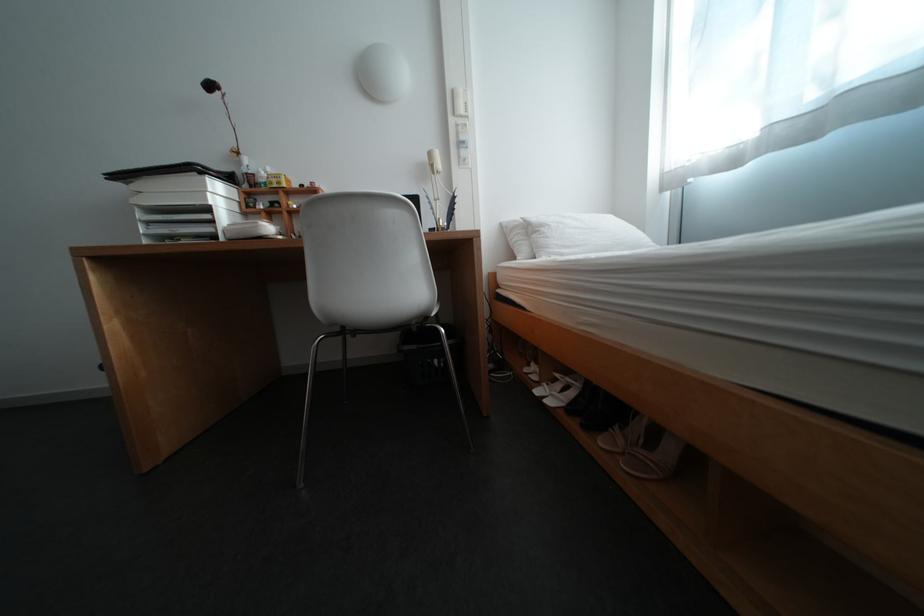
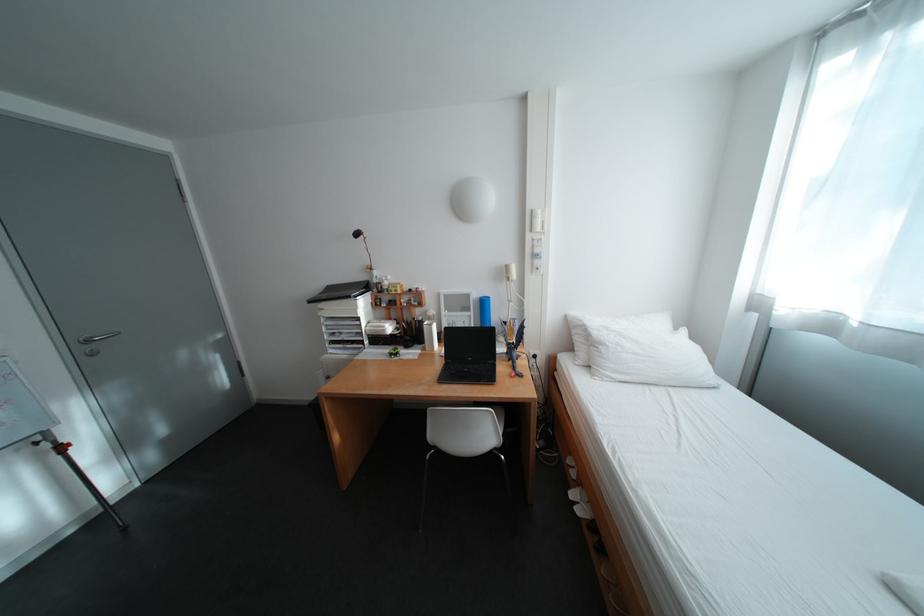
Locate, in the second image, the point that corresponds to [465,122] in the first image.

(541, 237)